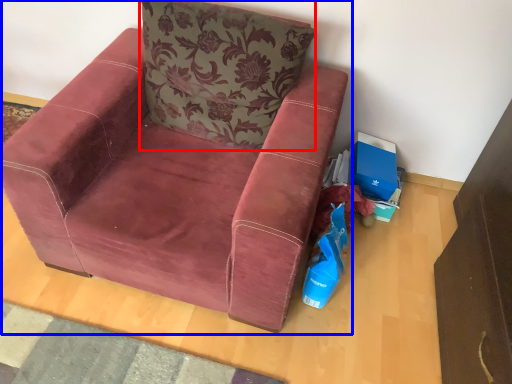
Question: Which object is further to the camera taking this photo, pillow (highlighted by a red box) or chair (highlighted by a blue box)?

Choices:
 (A) pillow
 (B) chair

Answer: (A)